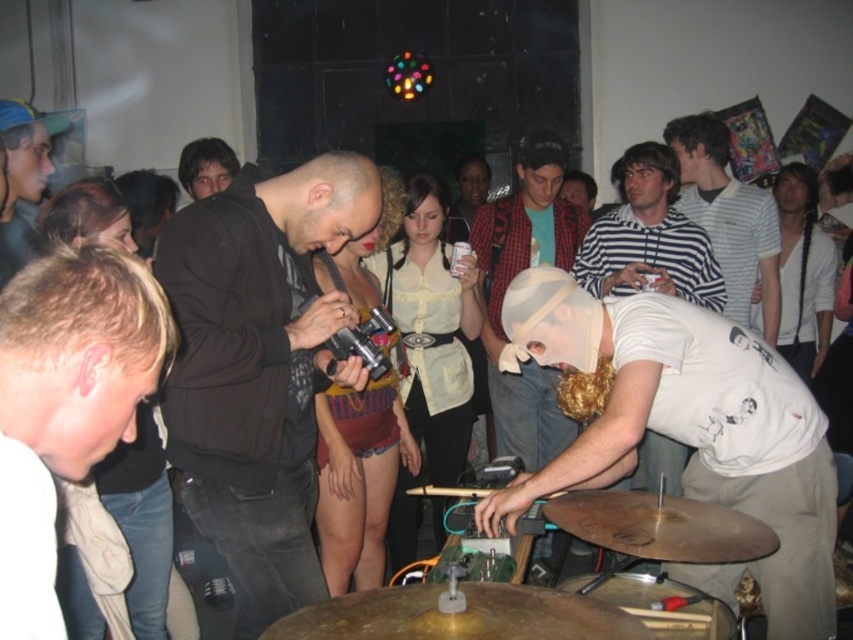
You are a GUI agent. You are given a task and a screenshot of the screen. Output one action in this format:
    pyautogui.click(x=<x>, y=<y>)
    Task: Click on the white cotton shirt at center
    
    Given the screenshot: What is the action you would take?
    click(x=648, y=236)

Is point (529, 259) closer to viewer compared to point (341, 596)?

No, (529, 259) is further to viewer.

Looking at this image, between red plaid shirt at center and gold metallic cymbal at center, which one appears on the right side from the viewer's perspective?

Positioned to the right is red plaid shirt at center.

This screenshot has height=640, width=853. What do you see at coordinates (508, 284) in the screenshot?
I see `red plaid shirt at center` at bounding box center [508, 284].

You are a GUI agent. You are given a task and a screenshot of the screen. Output one action in this format:
    pyautogui.click(x=<x>, y=<y>)
    Task: Click on the red plaid shirt at center
    
    Given the screenshot: What is the action you would take?
    pyautogui.click(x=508, y=284)

Where is `white matte shirt at lower left`? Image resolution: width=853 pixels, height=640 pixels. white matte shirt at lower left is located at coordinates (79, 353).

Is white matte shirt at lower left above red plaid shirt at center?

No, white matte shirt at lower left is not above red plaid shirt at center.

Who is more distant from viewer, (136,376) or (515,260)?

The point (515,260) is behind.

This screenshot has height=640, width=853. I want to click on white matte shirt at lower left, so 79,353.